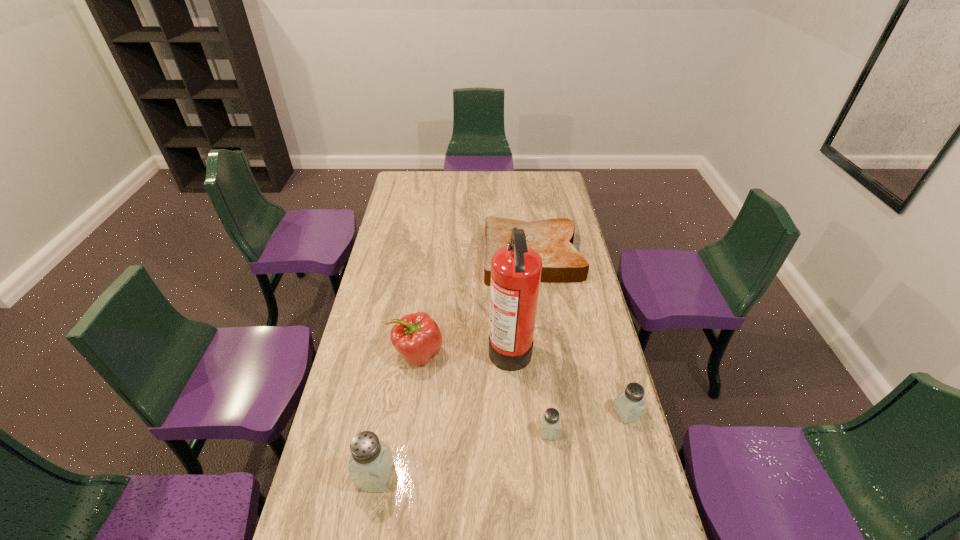
To achieve even spacing by inserting another saltshaker among them, please point to a vacant spot for this new saltshaker. Please provide its 2D coordinates. Your answer should be formatted as a tuple, i.e. [(x, y)], where the tuple contains the x and y coordinates of a point satisfying the conditions above.

[(465, 453)]